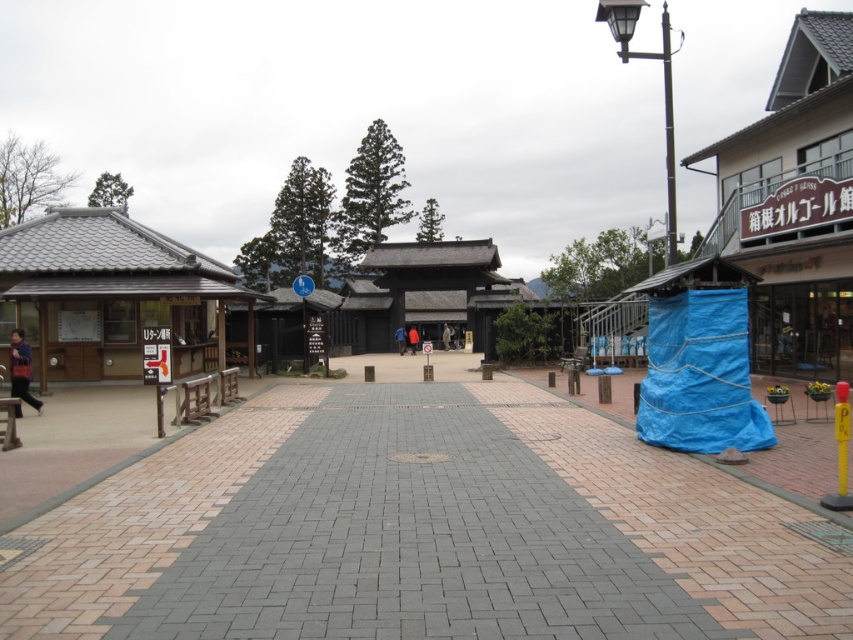
Question: Is brick paved walkway at center to the left of wooden signboard at left from the viewer's perspective?

Choices:
 (A) no
 (B) yes

Answer: (A)

Question: Considering the relative positions of brick paved walkway at center and wooden signboard at left in the image provided, where is brick paved walkway at center located with respect to wooden signboard at left?

Choices:
 (A) left
 (B) right

Answer: (B)

Question: Can you confirm if brick paved walkway at center is wider than wooden signboard at left?

Choices:
 (A) yes
 (B) no

Answer: (B)

Question: Which object appears farthest from the camera in this image?

Choices:
 (A) wooden signboard at left
 (B) brick paved walkway at center

Answer: (A)

Question: Among these objects, which one is nearest to the camera?

Choices:
 (A) brick paved walkway at center
 (B) wooden signboard at left

Answer: (A)